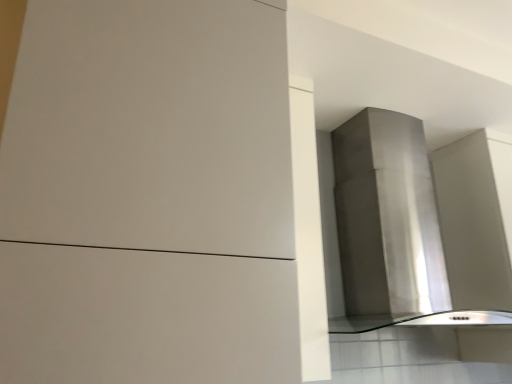
Find the location of `empty space that is ontop of stainless steel vent at upper right`. empty space that is ontop of stainless steel vent at upper right is located at coordinates (393, 109).